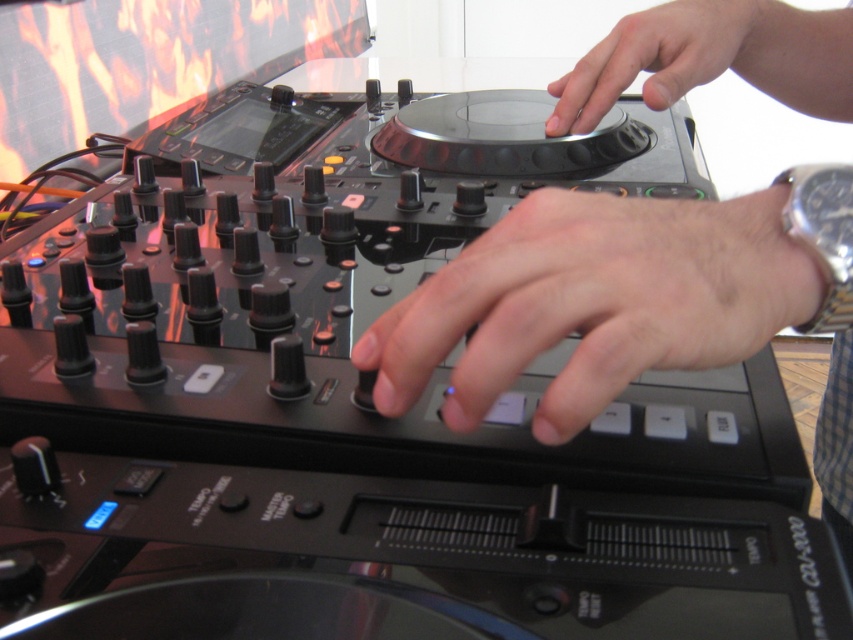
Based on the photo, is metallic silver turntable at center shorter than silver metallic watch at upper right?

Incorrect, metallic silver turntable at center's height does not fall short of silver metallic watch at upper right's.

Who is more forward, (473, 392) or (824, 205)?

Point (824, 205)

Is point (787, 49) positioned in front of point (816, 211)?

No, it is behind (816, 211).

Where is `metallic silver turntable at center`? metallic silver turntable at center is located at coordinates (634, 305).

Consider the image. Which is more to the left, metallic silver turntable at center or smooth skin hand at center?

From the viewer's perspective, smooth skin hand at center appears more on the left side.

This screenshot has height=640, width=853. What do you see at coordinates (634, 305) in the screenshot?
I see `metallic silver turntable at center` at bounding box center [634, 305].

At what (x,y) coordinates should I click in order to perform the action: click on metallic silver turntable at center. Please return your answer as a coordinate pair (x, y). Image resolution: width=853 pixels, height=640 pixels. Looking at the image, I should click on (634, 305).

Is metallic silver turntable at center wider than matte black turntable at center?

Indeed, metallic silver turntable at center has a greater width compared to matte black turntable at center.

Is point (599, 369) positioned after point (560, 113)?

No.

Locate an element on the screen. metallic silver turntable at center is located at coordinates (634, 305).